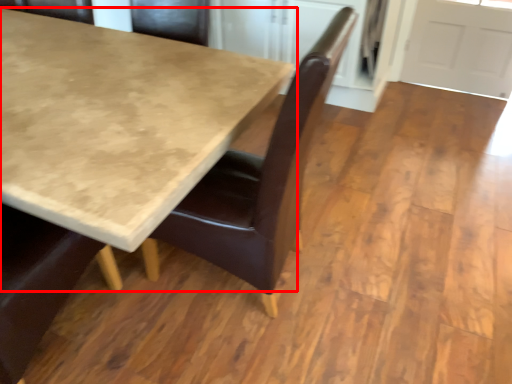
Question: From the image's perspective, where is table (annotated by the red box) located in relation to chair in the image?

Choices:
 (A) below
 (B) above

Answer: (B)